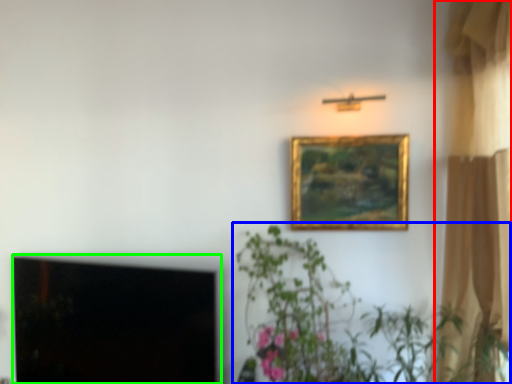
Question: Estimate the real-world distances between objects in this image. Which object is closer to curtain (highlighted by a red box), houseplant (highlighted by a blue box) or window screen (highlighted by a green box)?

Choices:
 (A) houseplant
 (B) window screen

Answer: (A)